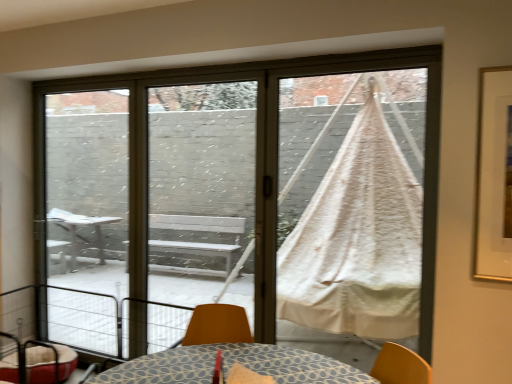
Question: Considering the relative sizes of metallic wire balcony at lower left and white cotton hammock at right in the image provided, is metallic wire balcony at lower left shorter than white cotton hammock at right?

Choices:
 (A) yes
 (B) no

Answer: (A)

Question: Does metallic wire balcony at lower left appear on the left side of white cotton hammock at right?

Choices:
 (A) yes
 (B) no

Answer: (A)

Question: Is metallic wire balcony at lower left positioned behind white cotton hammock at right?

Choices:
 (A) no
 (B) yes

Answer: (A)

Question: Does metallic wire balcony at lower left have a greater height compared to white cotton hammock at right?

Choices:
 (A) yes
 (B) no

Answer: (B)

Question: Is metallic wire balcony at lower left next to white cotton hammock at right?

Choices:
 (A) no
 (B) yes

Answer: (A)

Question: Is metallic wire balcony at lower left far away from white cotton hammock at right?

Choices:
 (A) yes
 (B) no

Answer: (A)

Question: Can you confirm if metallic wire balcony at lower left is taller than velvet red pet bed at lower left?

Choices:
 (A) yes
 (B) no

Answer: (A)

Question: From a real-world perspective, is metallic wire balcony at lower left physically below velvet red pet bed at lower left?

Choices:
 (A) no
 (B) yes

Answer: (A)

Question: Considering the relative positions of metallic wire balcony at lower left and velvet red pet bed at lower left in the image provided, is metallic wire balcony at lower left to the right of velvet red pet bed at lower left from the viewer's perspective?

Choices:
 (A) no
 (B) yes

Answer: (B)

Question: Is metallic wire balcony at lower left not inside velvet red pet bed at lower left?

Choices:
 (A) yes
 (B) no

Answer: (A)

Question: Is metallic wire balcony at lower left turned away from velvet red pet bed at lower left?

Choices:
 (A) no
 (B) yes

Answer: (B)

Question: Does metallic wire balcony at lower left have a smaller size compared to velvet red pet bed at lower left?

Choices:
 (A) no
 (B) yes

Answer: (A)

Question: Can you confirm if transparent glass screen door at center, positioned as the 1th screen door in right-to-left order, is positioned to the left of white cotton hammock at right?

Choices:
 (A) no
 (B) yes

Answer: (B)